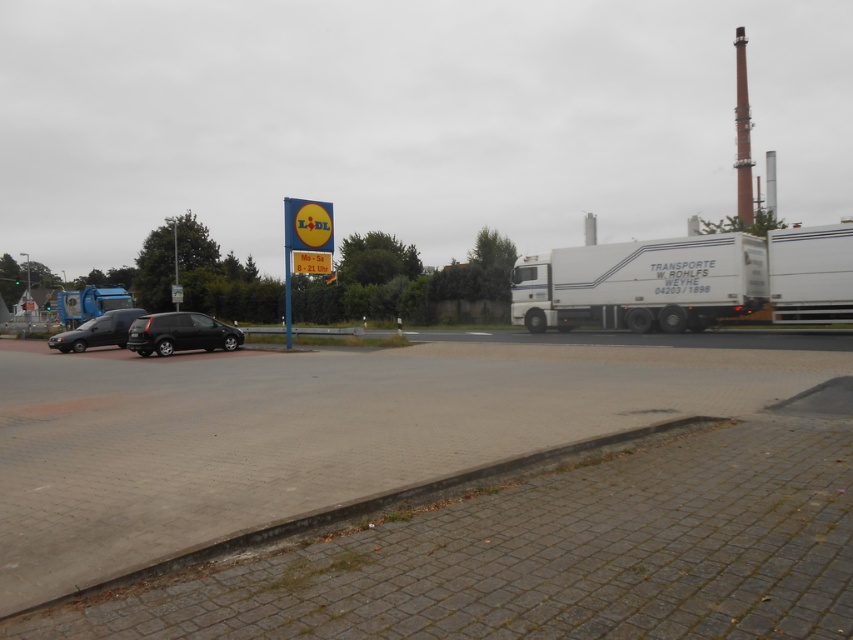
Can you confirm if shiny black car at left is bigger than shiny black car at lower left?

No, shiny black car at left is not bigger than shiny black car at lower left.

The height and width of the screenshot is (640, 853). I want to click on shiny black car at left, so 180,333.

Does white matte trailer truck at right have a lesser width compared to shiny black car at left?

No.

What do you see at coordinates (641, 284) in the screenshot? The height and width of the screenshot is (640, 853). I see `white matte trailer truck at right` at bounding box center [641, 284].

I want to click on white matte trailer truck at right, so click(641, 284).

Image resolution: width=853 pixels, height=640 pixels. Describe the element at coordinates (641, 284) in the screenshot. I see `white matte trailer truck at right` at that location.

Which of these two, white matte trailer truck at right or shiny black car at lower left, stands shorter?

shiny black car at lower left

At what (x,y) coordinates should I click in order to perform the action: click on white matte trailer truck at right. Please return your answer as a coordinate pair (x, y). Image resolution: width=853 pixels, height=640 pixels. Looking at the image, I should click on (641, 284).

Where is `white matte trailer truck at right`? Image resolution: width=853 pixels, height=640 pixels. white matte trailer truck at right is located at coordinates tap(641, 284).